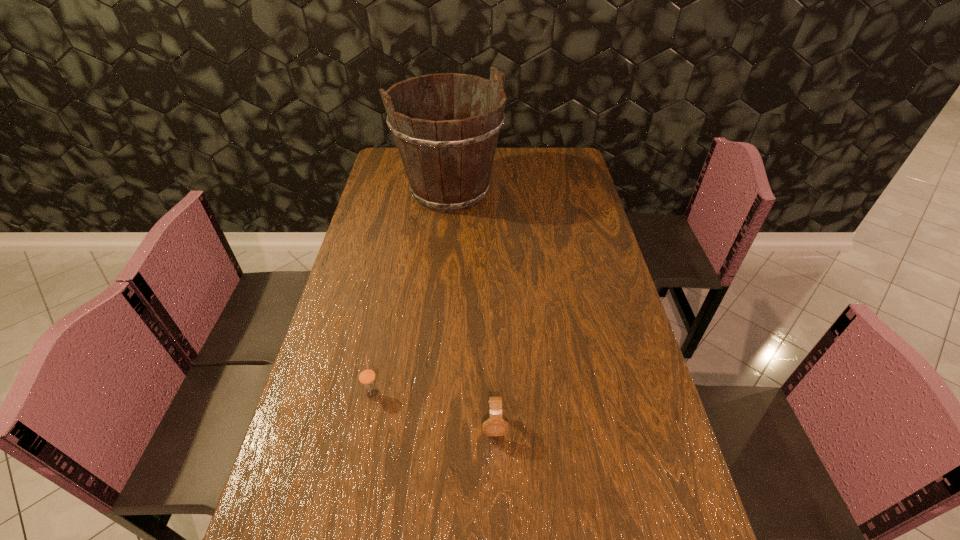
The image size is (960, 540). I want to click on bucket, so click(448, 158).

Image resolution: width=960 pixels, height=540 pixels. I want to click on the farthest object, so click(x=448, y=158).

Locate an element on the screen. This screenshot has width=960, height=540. the second shortest object is located at coordinates tap(366, 375).

The image size is (960, 540). Find the location of `the second farthest object`. the second farthest object is located at coordinates click(x=366, y=375).

Where is `watch`? This screenshot has width=960, height=540. watch is located at coordinates (495, 426).

Locate an element on the screen. Image resolution: width=960 pixels, height=540 pixels. the nearest object is located at coordinates (495, 426).

The height and width of the screenshot is (540, 960). In order to click on free space located 0.390m on the front of the bucket in this screenshot , I will do `click(440, 303)`.

This screenshot has width=960, height=540. Find the location of `vacant area situated on the front of the straw`. vacant area situated on the front of the straw is located at coordinates (352, 496).

Where is `vacant point located 0.180m on the face of the watch`? The image size is (960, 540). vacant point located 0.180m on the face of the watch is located at coordinates (497, 529).

Find the location of a particular element. object that is at the far edge is located at coordinates (448, 158).